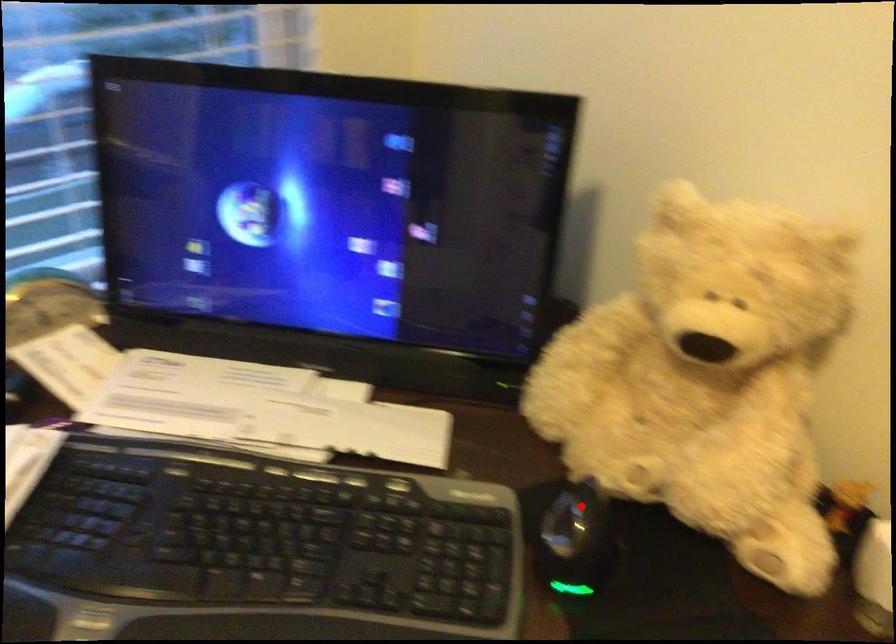
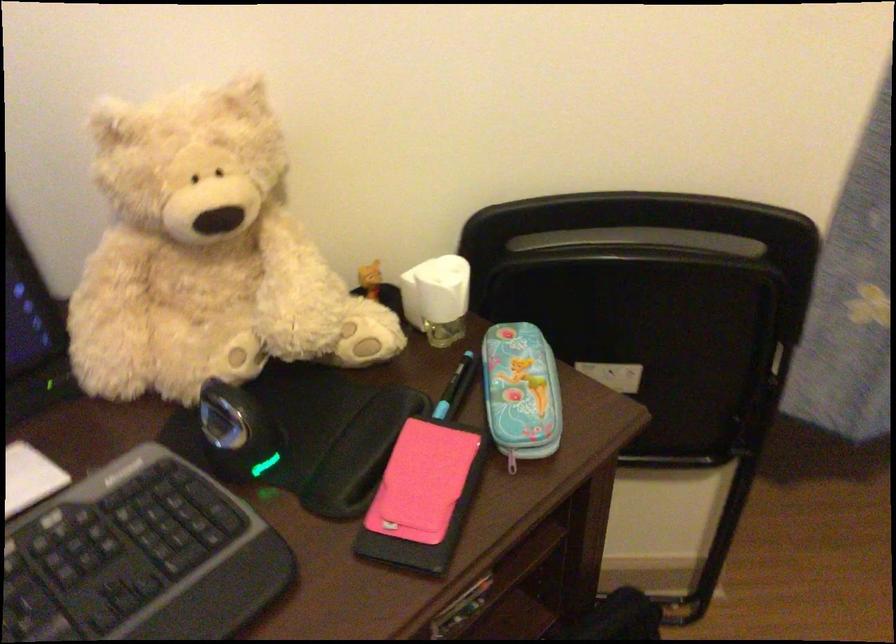
Find the pixel in the second image that matches the highlighted location in the first image.

(230, 402)